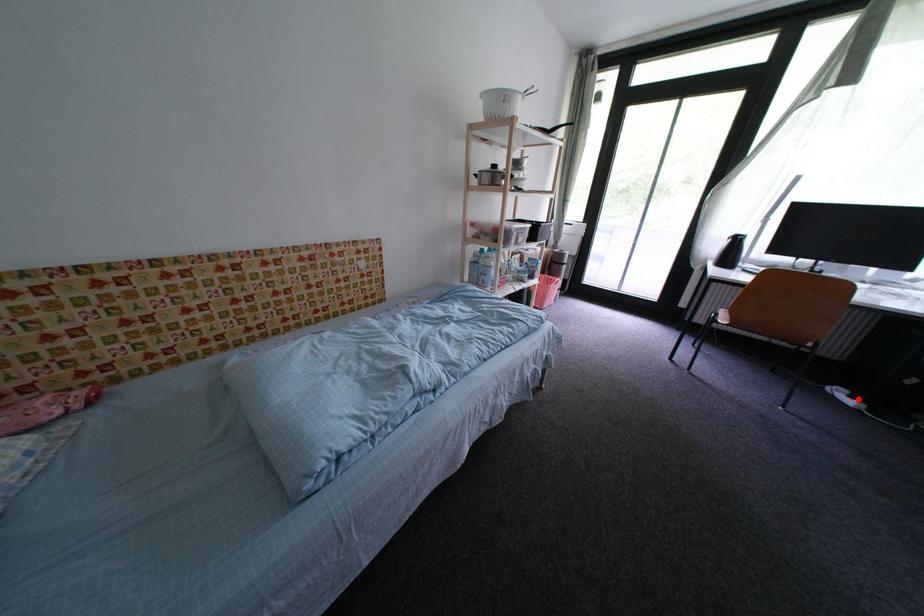
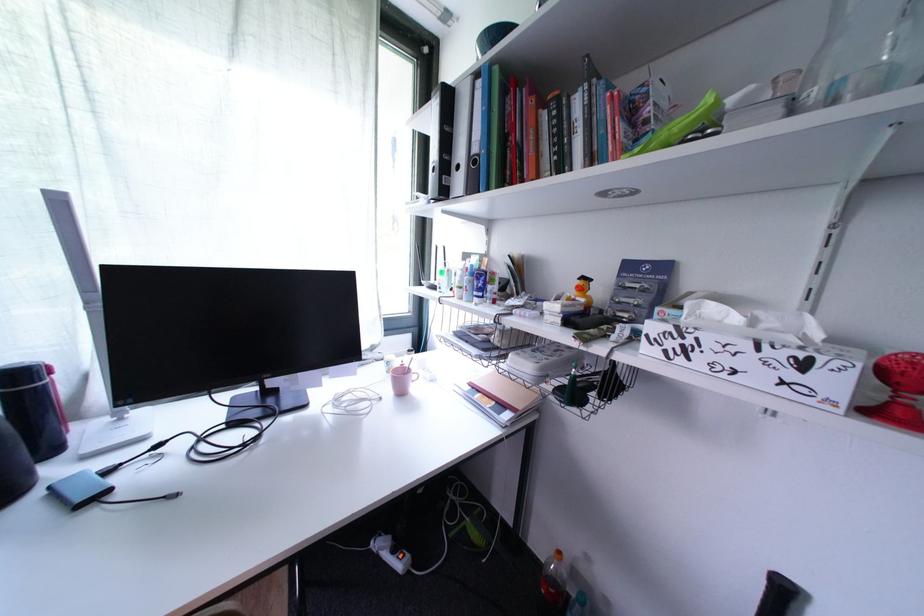
In the second image, find the point that corresponds to the highlighted location in the first image.

(402, 553)